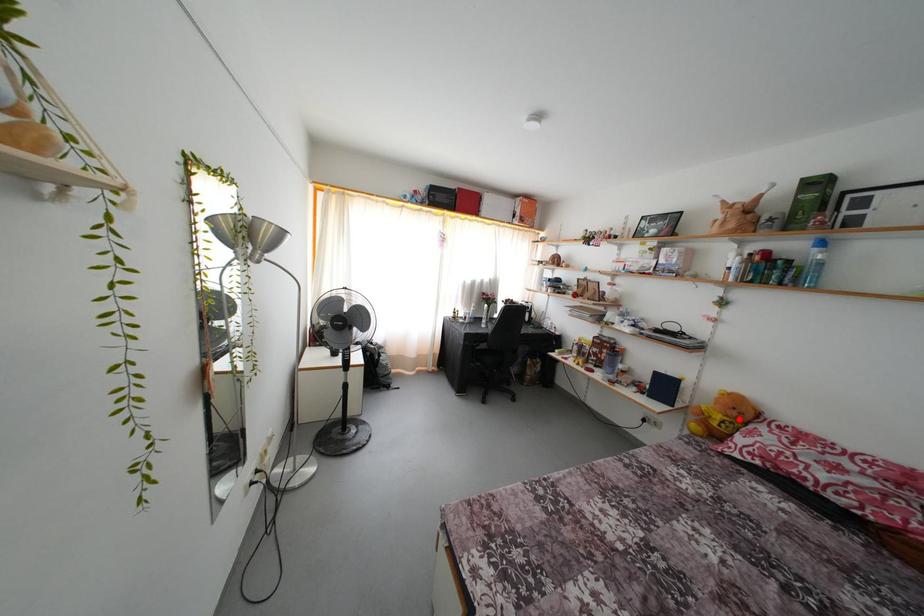
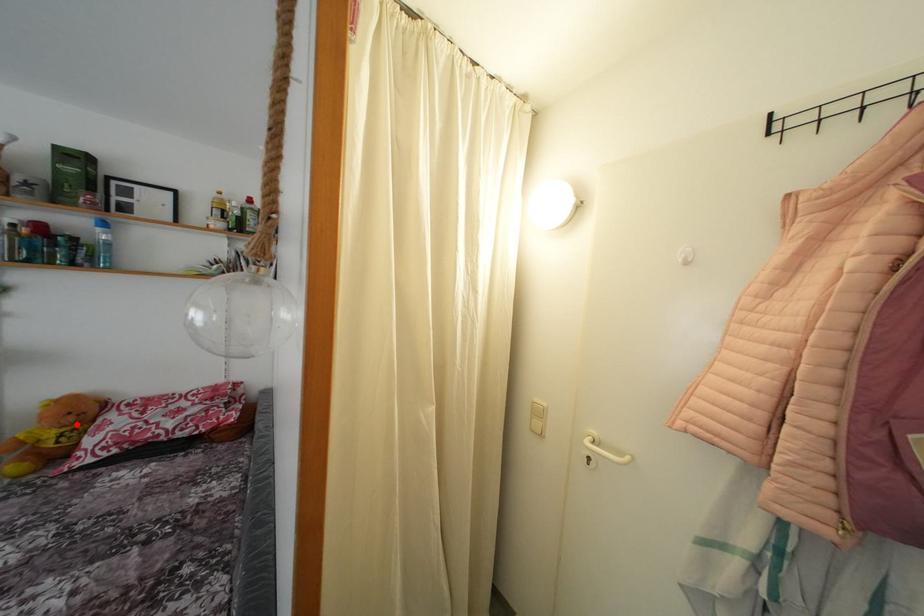
I am providing you with two images of the same scene from different viewpoints. A red point is marked on the first image and another point is marked on the second image. Does the point marked in image1 correspond to the same location as the one in image2?

Yes